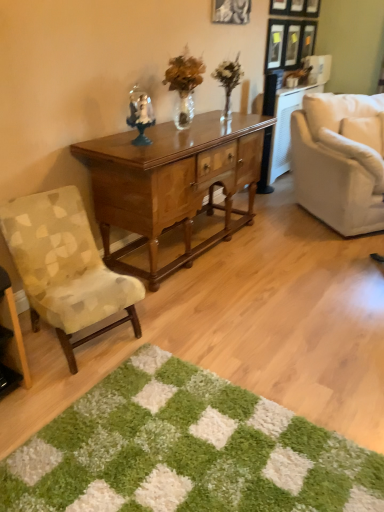
Identify the location of free location in front of translucent glass vase at center. (228, 126).